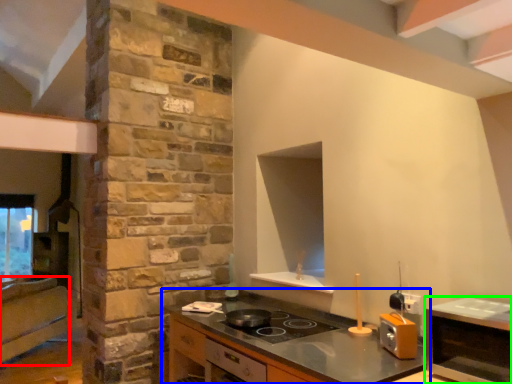
Question: Based on their relative distances, which object is farther from cabinetry (highlighted by a red box)? Choose from countertop (highlighted by a blue box) and microwave (highlighted by a green box).

Choices:
 (A) countertop
 (B) microwave

Answer: (B)